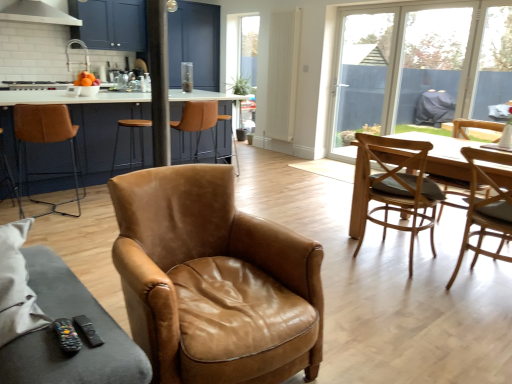
Question: From the image's perspective, is light brown wooden chair at right, which appears as the third chair when viewed from the right, on top of black plastic remote at lower left?

Choices:
 (A) no
 (B) yes

Answer: (B)

Question: Is light brown wooden chair at right, the 4th chair from the left, wider than black plastic remote at lower left?

Choices:
 (A) no
 (B) yes

Answer: (B)

Question: From the image's perspective, is light brown wooden chair at right, the 4th chair from the left, under black plastic remote at lower left?

Choices:
 (A) yes
 (B) no

Answer: (B)

Question: From a real-world perspective, is light brown wooden chair at right, the 4th chair from the left, over black plastic remote at lower left?

Choices:
 (A) no
 (B) yes

Answer: (A)

Question: Is light brown wooden chair at right, the 4th chair from the left, in contact with black plastic remote at lower left?

Choices:
 (A) yes
 (B) no

Answer: (B)

Question: From their relative heights in the image, would you say brown leather armchair at center, which is the third chair from left to right, is taller or shorter than white glossy exhaust hood at upper left?

Choices:
 (A) tall
 (B) short

Answer: (A)

Question: Visually, is brown leather armchair at center, acting as the 4th chair starting from the right, positioned to the left or to the right of white glossy exhaust hood at upper left?

Choices:
 (A) left
 (B) right

Answer: (B)

Question: Relative to white glossy exhaust hood at upper left, is brown leather armchair at center, which is the third chair from left to right, in front or behind?

Choices:
 (A) front
 (B) behind

Answer: (A)

Question: From a real-world perspective, is brown leather armchair at center, acting as the 4th chair starting from the right, physically located above or below white glossy exhaust hood at upper left?

Choices:
 (A) below
 (B) above

Answer: (A)

Question: Would you say brown leather chair at center, the 5th chair from the right, is inside or outside transparent glass screen door at upper center?

Choices:
 (A) inside
 (B) outside

Answer: (B)

Question: In terms of width, does brown leather chair at center, the 2th chair from the left, look wider or thinner when compared to transparent glass screen door at upper center?

Choices:
 (A) thin
 (B) wide

Answer: (A)

Question: Based on their sizes in the image, would you say brown leather chair at center, the 5th chair from the right, is bigger or smaller than transparent glass screen door at upper center?

Choices:
 (A) small
 (B) big

Answer: (A)

Question: Is brown leather chair at center, the 5th chair from the right, in front of or behind transparent glass screen door at upper center in the image?

Choices:
 (A) front
 (B) behind

Answer: (A)

Question: Is point (178, 21) positioned closer to the camera than point (370, 31)?

Choices:
 (A) closer
 (B) farther

Answer: (B)

Question: Considering the relative positions of transparent glass screen door at upper center and transparent glass door at center, which is the 1th window screen in left-to-right order, in the image provided, is transparent glass screen door at upper center to the left or to the right of transparent glass door at center, which is the 1th window screen in left-to-right order,?

Choices:
 (A) right
 (B) left

Answer: (B)